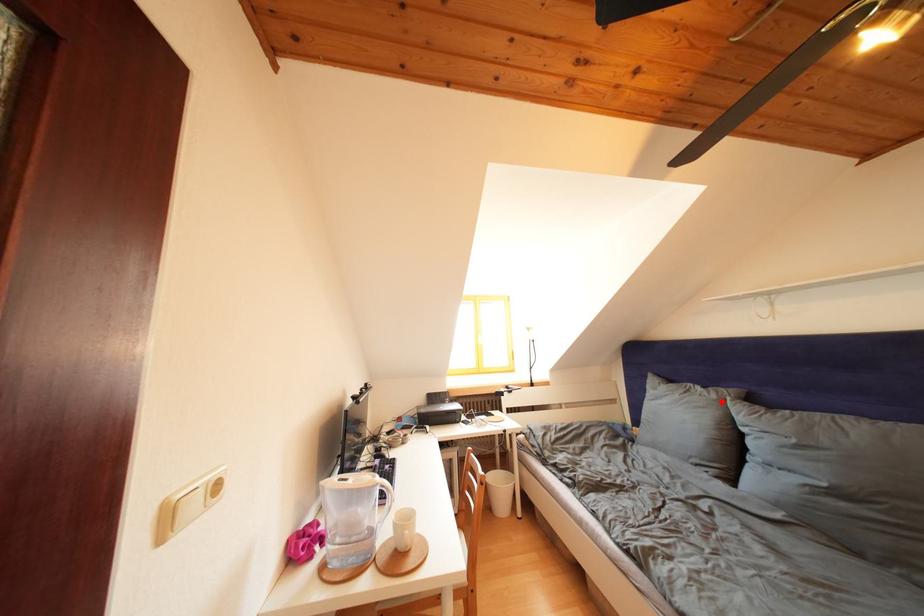
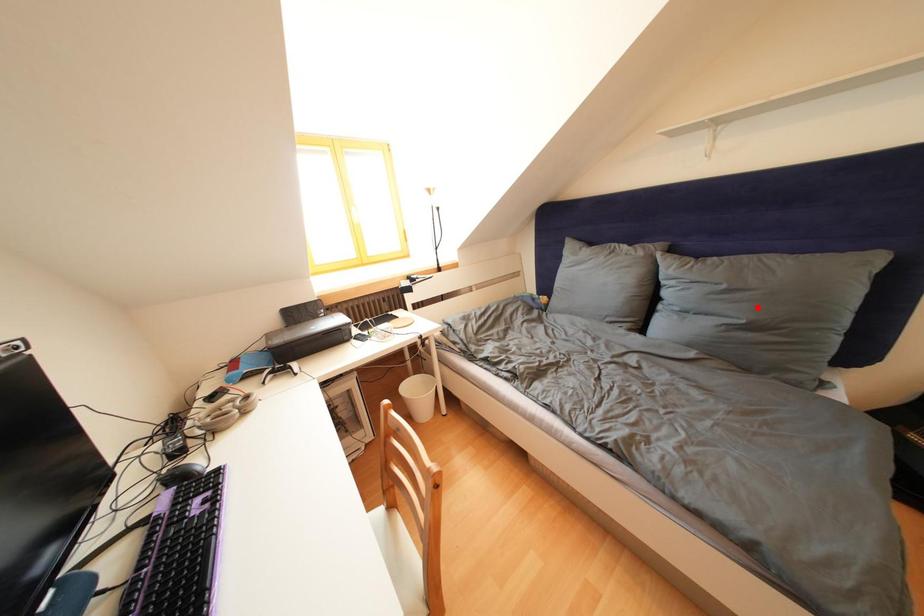
I am providing you with two images of the same scene from different viewpoints. A red point is marked on the first image and another point is marked on the second image. Is the red point in image1 aligned with the point shown in image2?

No